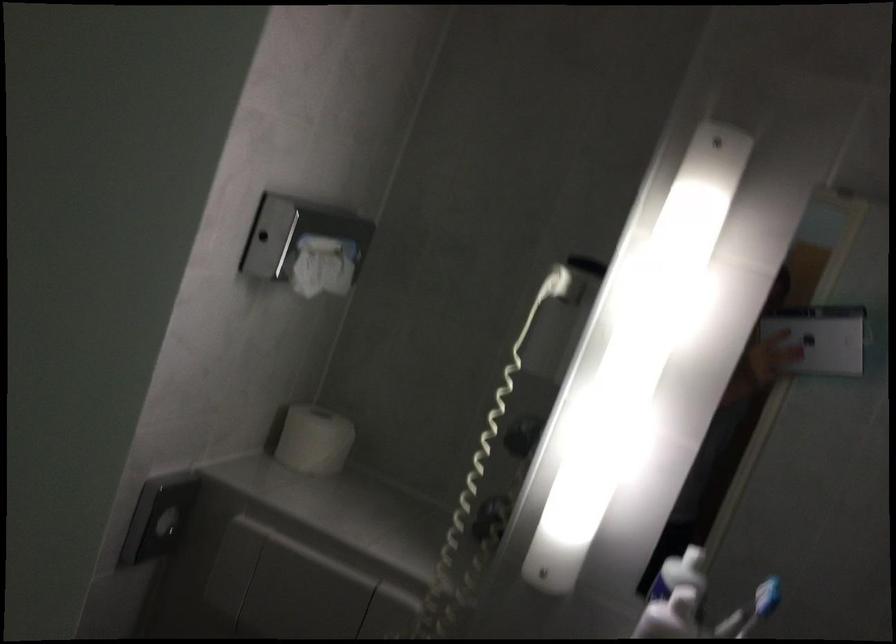
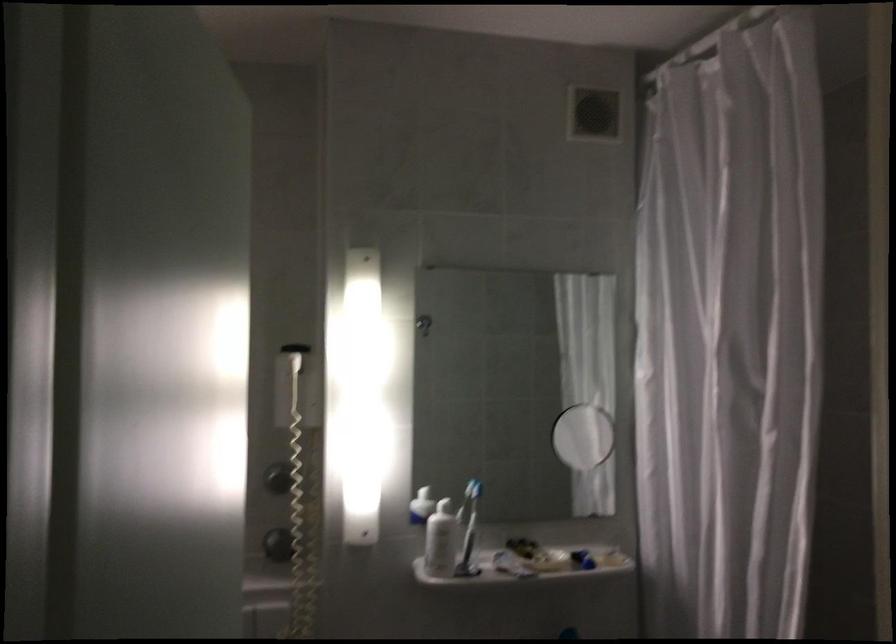
Locate, in the second image, the point that corresponds to (514,442) in the first image.

(278, 478)